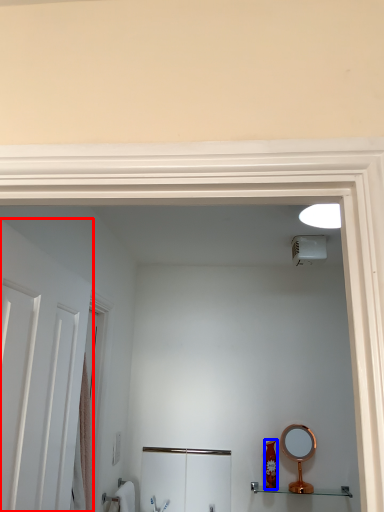
Question: Which point is closer to the camera, door (highlighted by a red box) or toiletry (highlighted by a blue box)?

Choices:
 (A) door
 (B) toiletry

Answer: (A)